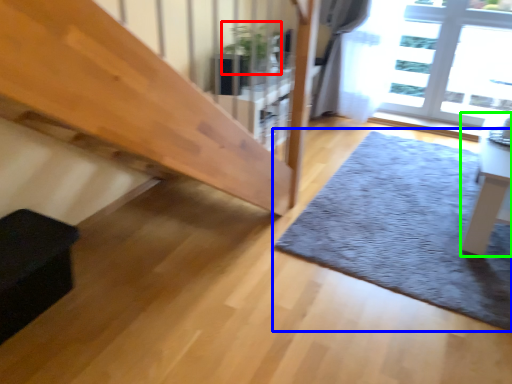
Question: Considering the real-world distances, which object is closest to plant (highlighted by a red box)? mat (highlighted by a blue box) or table (highlighted by a green box).

Choices:
 (A) mat
 (B) table

Answer: (A)